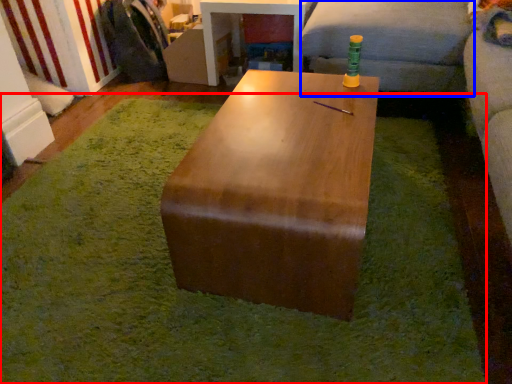
Question: Which of the following is the closest to the observer, mat (highlighted by a red box) or couch (highlighted by a blue box)?

Choices:
 (A) mat
 (B) couch

Answer: (A)